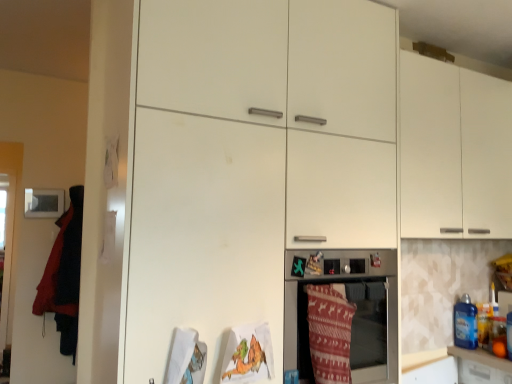
Question: From the image's perspective, does velvet red blanket at left, which is the 1th blanket in left-to-right order, appear lower than matte white oven at center?

Choices:
 (A) no
 (B) yes

Answer: (B)

Question: Is velvet red blanket at left, which is the 1th blanket in left-to-right order, outside matte white oven at center?

Choices:
 (A) no
 (B) yes

Answer: (B)

Question: Does velvet red blanket at left, which is the 1th blanket in left-to-right order, have a lesser width compared to matte white oven at center?

Choices:
 (A) yes
 (B) no

Answer: (A)

Question: Is velvet red blanket at left, which is the 1th blanket in left-to-right order, at the left side of matte white oven at center?

Choices:
 (A) yes
 (B) no

Answer: (A)

Question: Is velvet red blanket at left, which is the 1th blanket in left-to-right order, bigger than matte white oven at center?

Choices:
 (A) no
 (B) yes

Answer: (A)

Question: From the image's perspective, is blue plastic bottle at right positioned above or below knitted woolen blanket at lower center, placed as the 1th blanket when sorted from front to back?

Choices:
 (A) above
 (B) below

Answer: (B)

Question: Is blue plastic bottle at right inside the boundaries of knitted woolen blanket at lower center, the 1th blanket viewed from the right, or outside?

Choices:
 (A) inside
 (B) outside

Answer: (B)

Question: From a real-world perspective, is blue plastic bottle at right above or below knitted woolen blanket at lower center, placed as the 1th blanket when sorted from front to back?

Choices:
 (A) above
 (B) below

Answer: (B)

Question: Considering the positions of blue plastic bottle at right and knitted woolen blanket at lower center, placed as the second blanket when sorted from left to right, in the image, is blue plastic bottle at right taller or shorter than knitted woolen blanket at lower center, placed as the second blanket when sorted from left to right,?

Choices:
 (A) tall
 (B) short

Answer: (B)

Question: Is velvet red blanket at left, which is the 1th blanket in left-to-right order, to the left or to the right of blue plastic bottle at right in the image?

Choices:
 (A) left
 (B) right

Answer: (A)

Question: Considering the positions of point (72, 322) and point (461, 322), is point (72, 322) closer or farther from the camera than point (461, 322)?

Choices:
 (A) closer
 (B) farther

Answer: (B)

Question: Based on their sizes in the image, would you say velvet red blanket at left, placed as the 2th blanket when sorted from right to left, is bigger or smaller than blue plastic bottle at right?

Choices:
 (A) big
 (B) small

Answer: (A)

Question: Which is correct: velvet red blanket at left, which ranks as the 1th blanket in back-to-front order, is inside blue plastic bottle at right, or outside of it?

Choices:
 (A) outside
 (B) inside

Answer: (A)

Question: Is matte white oven at center bigger or smaller than velvet red blanket at left, which is the 1th blanket in left-to-right order?

Choices:
 (A) small
 (B) big

Answer: (B)

Question: Would you say matte white oven at center is inside or outside velvet red blanket at left, positioned as the second blanket in front-to-back order?

Choices:
 (A) outside
 (B) inside

Answer: (A)